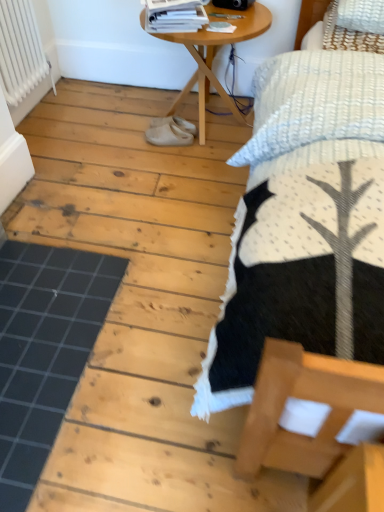
Question: Are white textured bed at upper right and wooden table at center beside each other?

Choices:
 (A) yes
 (B) no

Answer: (B)

Question: From the image's perspective, does white textured bed at upper right appear higher than wooden table at center?

Choices:
 (A) yes
 (B) no

Answer: (B)

Question: Does white textured bed at upper right turn towards wooden table at center?

Choices:
 (A) yes
 (B) no

Answer: (B)

Question: Would you say white textured bed at upper right is outside wooden table at center?

Choices:
 (A) no
 (B) yes

Answer: (B)

Question: Can you confirm if white textured bed at upper right is wider than wooden table at center?

Choices:
 (A) yes
 (B) no

Answer: (A)

Question: From the image's perspective, is white suede shoes at center, placed as the first footwear when sorted from top to bottom, above or below white painted metal radiator at upper left?

Choices:
 (A) above
 (B) below

Answer: (B)

Question: From a real-world perspective, relative to white painted metal radiator at upper left, is white suede shoes at center, the 2th footwear from the bottom, vertically above or below?

Choices:
 (A) below
 (B) above

Answer: (A)

Question: Relative to white painted metal radiator at upper left, is white suede shoes at center, the 2th footwear from the bottom, in front or behind?

Choices:
 (A) front
 (B) behind

Answer: (B)

Question: Does point (172, 121) appear closer or farther from the camera than point (14, 30)?

Choices:
 (A) closer
 (B) farther

Answer: (B)

Question: Is white painted metal radiator at upper left in front of or behind white glossy magazine at upper center in the image?

Choices:
 (A) behind
 (B) front

Answer: (A)

Question: Considering the positions of white painted metal radiator at upper left and white glossy magazine at upper center in the image, is white painted metal radiator at upper left taller or shorter than white glossy magazine at upper center?

Choices:
 (A) short
 (B) tall

Answer: (B)

Question: From the image's perspective, is white painted metal radiator at upper left positioned above or below white glossy magazine at upper center?

Choices:
 (A) below
 (B) above

Answer: (A)

Question: Based on their sizes in the image, would you say white painted metal radiator at upper left is bigger or smaller than white glossy magazine at upper center?

Choices:
 (A) big
 (B) small

Answer: (A)

Question: Considering the positions of wooden table at center and white glossy magazine at upper center in the image, is wooden table at center bigger or smaller than white glossy magazine at upper center?

Choices:
 (A) small
 (B) big

Answer: (B)

Question: From a real-world perspective, relative to white glossy magazine at upper center, is wooden table at center vertically above or below?

Choices:
 (A) above
 (B) below

Answer: (B)